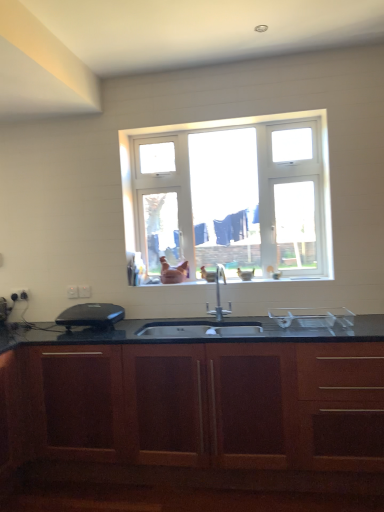
Question: Is wooden cabinet at center far from white plastic electric outlet at lower left, which is the third electric outlet from front to back?

Choices:
 (A) no
 (B) yes

Answer: (B)

Question: From a real-world perspective, is wooden cabinet at center positioned over white plastic electric outlet at lower left, positioned as the 1th electric outlet in left-to-right order, based on gravity?

Choices:
 (A) yes
 (B) no

Answer: (B)

Question: Does wooden cabinet at center have a larger size compared to white plastic electric outlet at lower left, which is the third electric outlet from front to back?

Choices:
 (A) yes
 (B) no

Answer: (A)

Question: From the image's perspective, does wooden cabinet at center appear lower than white plastic electric outlet at lower left, which is the third electric outlet from front to back?

Choices:
 (A) no
 (B) yes

Answer: (B)

Question: Is wooden cabinet at center to the left of white plastic electric outlet at lower left, the first electric outlet in the back-to-front sequence, from the viewer's perspective?

Choices:
 (A) no
 (B) yes

Answer: (A)

Question: Looking at their shapes, would you say white plastic electric outlet at lower left, which is the third electric outlet from front to back, is wider or thinner than wooden cabinet at center?

Choices:
 (A) wide
 (B) thin

Answer: (B)

Question: From a real-world perspective, is white plastic electric outlet at lower left, positioned as the 1th electric outlet in left-to-right order, above or below wooden cabinet at center?

Choices:
 (A) below
 (B) above

Answer: (B)

Question: Is white plastic electric outlet at lower left, which is counted as the third electric outlet, starting from the right, taller or shorter than wooden cabinet at center?

Choices:
 (A) short
 (B) tall

Answer: (A)

Question: Is white plastic electric outlet at lower left, the first electric outlet in the back-to-front sequence, spatially inside wooden cabinet at center, or outside of it?

Choices:
 (A) outside
 (B) inside

Answer: (A)

Question: Relative to white plastic window at center, is white glossy sink at center in front or behind?

Choices:
 (A) front
 (B) behind

Answer: (A)

Question: From the image's perspective, is white glossy sink at center above or below white plastic window at center?

Choices:
 (A) below
 (B) above

Answer: (A)

Question: From a real-world perspective, is white glossy sink at center physically located above or below white plastic window at center?

Choices:
 (A) below
 (B) above

Answer: (A)

Question: Choose the correct answer: Is white glossy sink at center inside white plastic window at center or outside it?

Choices:
 (A) inside
 (B) outside

Answer: (B)

Question: In terms of height, does black plastic appliance at left look taller or shorter compared to wooden cabinet at center?

Choices:
 (A) tall
 (B) short

Answer: (B)

Question: Is black plastic appliance at left in front of or behind wooden cabinet at center in the image?

Choices:
 (A) front
 (B) behind

Answer: (B)